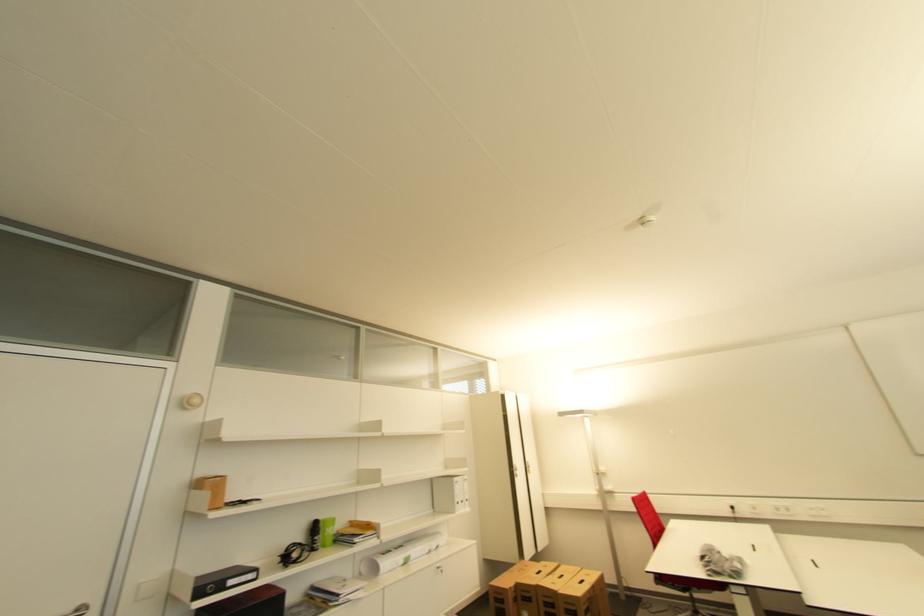
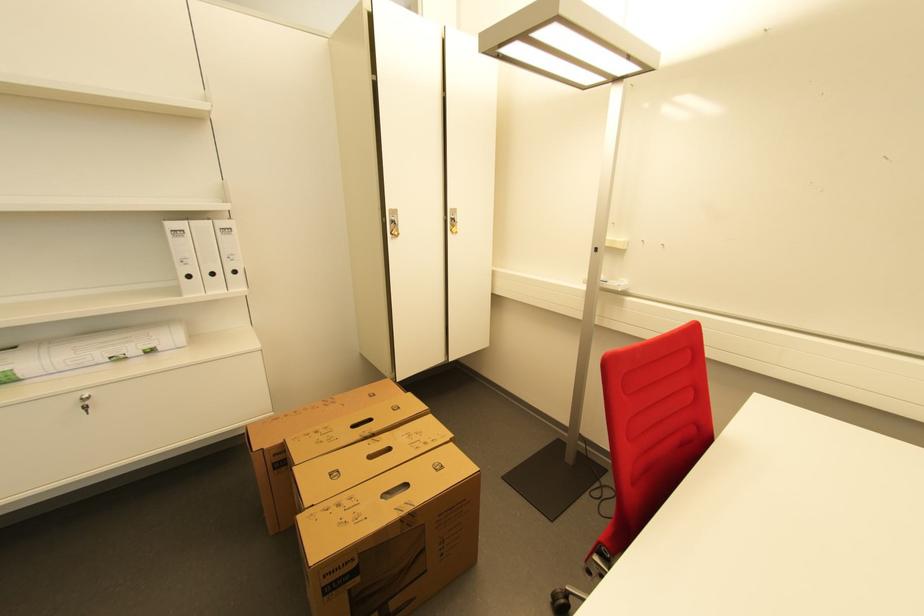
Where in the second image is the point corresponding to the point at 472,501 from the first image?

(239, 273)